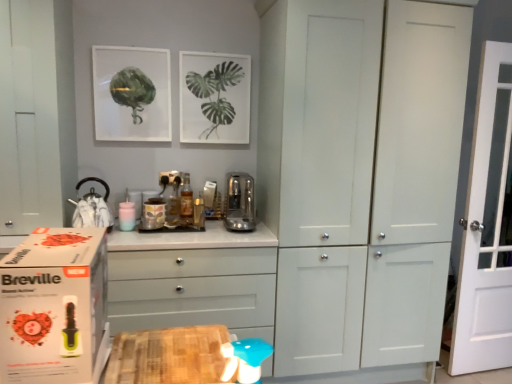
Question: Does white matte cupboard at center have a smaller size compared to white glossy chest of drawers at center?

Choices:
 (A) no
 (B) yes

Answer: (A)

Question: From the image's perspective, is white matte cupboard at center on white glossy chest of drawers at center?

Choices:
 (A) no
 (B) yes

Answer: (B)

Question: Can you confirm if white matte cupboard at center is thinner than white glossy chest of drawers at center?

Choices:
 (A) yes
 (B) no

Answer: (B)

Question: Is white matte cupboard at center further to the viewer compared to white glossy chest of drawers at center?

Choices:
 (A) yes
 (B) no

Answer: (A)

Question: Would you say white matte cupboard at center is outside white glossy chest of drawers at center?

Choices:
 (A) no
 (B) yes

Answer: (B)

Question: Does point tap(440, 173) appear closer or farther from the camera than point tap(161, 218)?

Choices:
 (A) closer
 (B) farther

Answer: (A)

Question: From the image's perspective, is white matte cupboard at center above or below matte ceramic jar at center, which is the 2th appliance in right-to-left order?

Choices:
 (A) above
 (B) below

Answer: (A)

Question: In the image, is white matte cupboard at center on the left side or the right side of matte ceramic jar at center, acting as the second appliance starting from the left?

Choices:
 (A) right
 (B) left

Answer: (A)

Question: From a real-world perspective, is white matte cupboard at center positioned above or below matte ceramic jar at center, acting as the second appliance starting from the left?

Choices:
 (A) below
 (B) above

Answer: (B)

Question: Considering the relative positions of blue plastic toy at lower center and white cardboard box at left in the image provided, is blue plastic toy at lower center to the left or to the right of white cardboard box at left?

Choices:
 (A) right
 (B) left

Answer: (A)

Question: Choose the correct answer: Is blue plastic toy at lower center inside white cardboard box at left or outside it?

Choices:
 (A) outside
 (B) inside

Answer: (A)

Question: Is blue plastic toy at lower center taller or shorter than white cardboard box at left?

Choices:
 (A) short
 (B) tall

Answer: (B)

Question: Based on their sizes in the image, would you say blue plastic toy at lower center is bigger or smaller than white cardboard box at left?

Choices:
 (A) big
 (B) small

Answer: (B)

Question: From a real-world perspective, is matte ceramic jar at center, acting as the second appliance starting from the left, positioned above or below matte glass picture frame at upper left, the 1th picture frame positioned from the left?

Choices:
 (A) below
 (B) above

Answer: (A)

Question: Is matte ceramic jar at center, which is the 2th appliance in right-to-left order, inside the boundaries of matte glass picture frame at upper left, the second picture frame when ordered from right to left, or outside?

Choices:
 (A) inside
 (B) outside

Answer: (B)